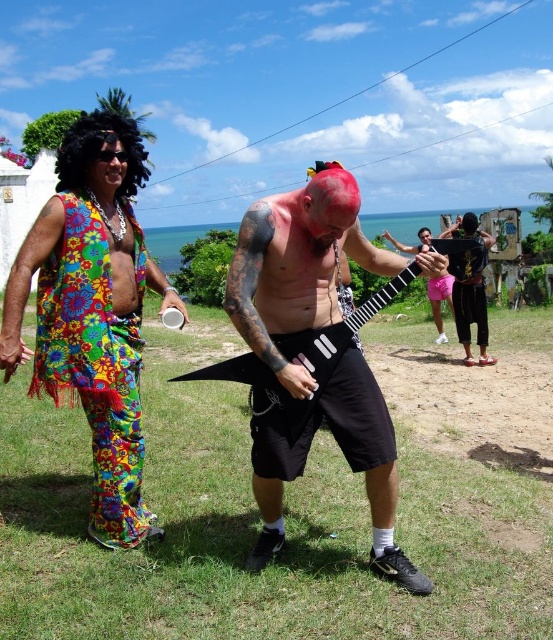
Question: Does shiny black shorts at center appear on the right side of black curly wig at upper left?

Choices:
 (A) yes
 (B) no

Answer: (A)

Question: Which of the following is the closest to the observer?

Choices:
 (A) (437, 282)
 (B) (419, 588)

Answer: (B)

Question: Is green grass at lower center closer to the viewer compared to black curly wig at upper left?

Choices:
 (A) yes
 (B) no

Answer: (A)

Question: Which point is closer to the camera?

Choices:
 (A) (66, 396)
 (B) (419, 236)
 (C) (452, 301)

Answer: (A)

Question: Can you confirm if black curly wig at upper left is bigger than pink matte guitar at center?

Choices:
 (A) no
 (B) yes

Answer: (B)

Question: Which of the following is the closest to the observer?

Choices:
 (A) [425, 243]
 (B) [473, 262]

Answer: (B)